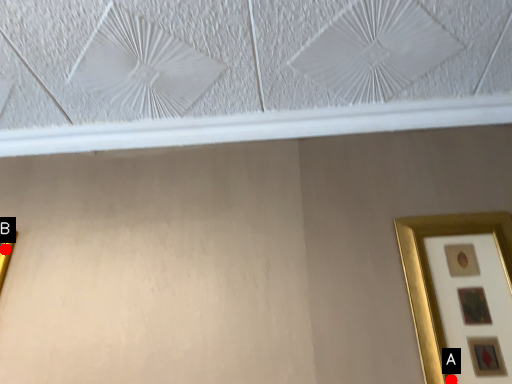
Question: Two points are circled on the image, labeled by A and B beside each circle. Which point is farther to the camera?

Choices:
 (A) A is further
 (B) B is further

Answer: (B)